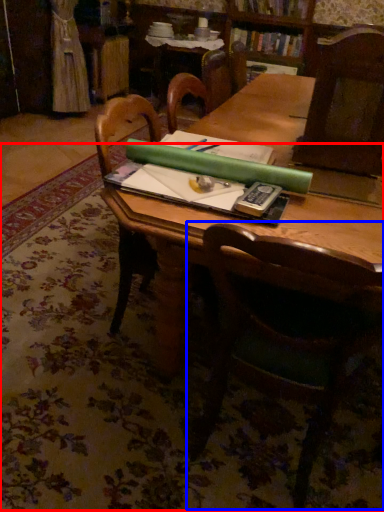
Question: Among these objects, which one is farthest to the camera, mat (highlighted by a red box) or chair (highlighted by a blue box)?

Choices:
 (A) mat
 (B) chair

Answer: (A)